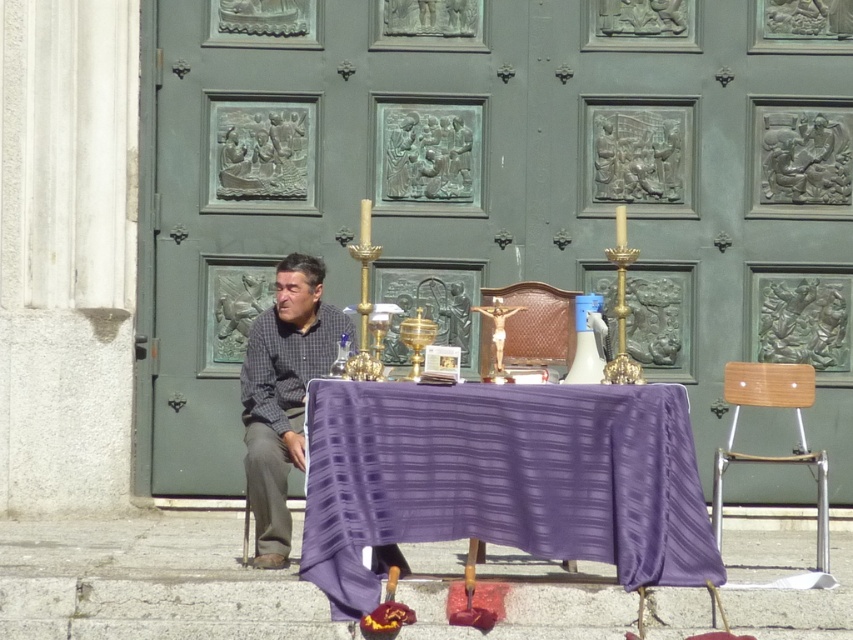
From the picture: Is gray checkered shirt at left below wooden at right?

Incorrect, gray checkered shirt at left is not positioned below wooden at right.

Based on the photo, can you confirm if gray checkered shirt at left is thinner than wooden at right?

Indeed, gray checkered shirt at left has a lesser width compared to wooden at right.

The image size is (853, 640). I want to click on gray checkered shirt at left, so click(x=283, y=394).

This screenshot has width=853, height=640. Find the location of `wooden at right`. wooden at right is located at coordinates (770, 456).

Who is more distant from viewer, [808,385] or [270,506]?

Point [808,385]

Is point (825, 467) positioned before point (274, 513)?

That is True.

Where is `wooden at right`? wooden at right is located at coordinates [770, 456].

Does gray checkered shirt at left come in front of brown leather chair at center?

Yes, it is.

Between gray checkered shirt at left and brown leather chair at center, which one is positioned higher?

brown leather chair at center is above.

Who is more distant from viewer, (286, 532) or (567, 300)?

The point (567, 300) is behind.

The width and height of the screenshot is (853, 640). Identify the location of gray checkered shirt at left. (283, 394).